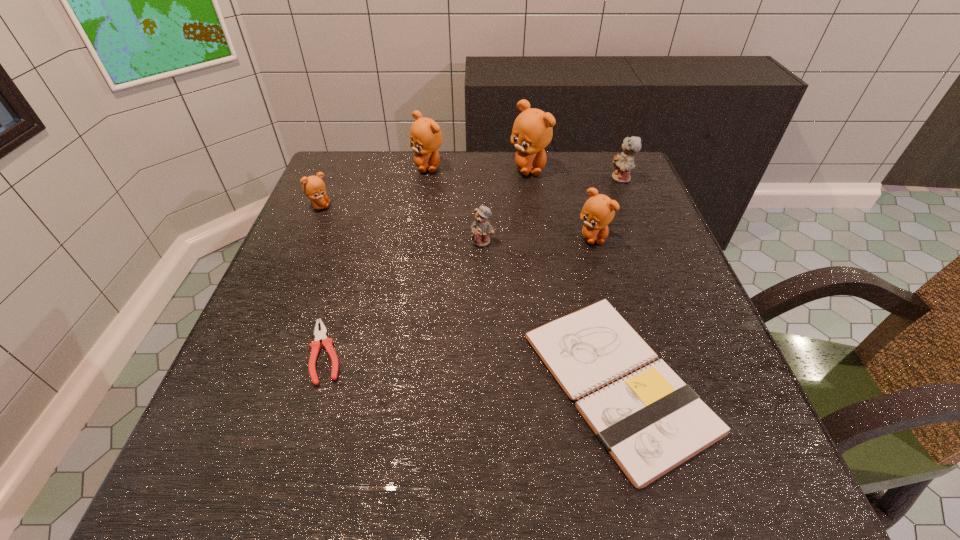
What are the coordinates of `the third closest teddy bear to the leftmost object` in the screenshot? It's located at (532, 131).

Where is `teddy bear identified as the fourth closest to the fourth object from left to right`? teddy bear identified as the fourth closest to the fourth object from left to right is located at coordinates (314, 188).

Identify which brown teddy bear is the third closest to the shortest object. Please provide its 2D coordinates. Your answer should be formatted as a tuple, i.e. [(x, y)], where the tuple contains the x and y coordinates of a point satisfying the conditions above.

[(425, 135)]

Locate which brown teddy bear ranks fourth in proximity to the smaller blue teddy bear. Please provide its 2D coordinates. Your answer should be formatted as a tuple, i.e. [(x, y)], where the tuple contains the x and y coordinates of a point satisfying the conditions above.

[(314, 188)]

The width and height of the screenshot is (960, 540). In order to click on free space in the image that satisfies the following two spatial constraints: 1. on the front-facing side of the right blue teddy bear; 2. on the face of the rightmost brown teddy bear in this screenshot , I will do `click(645, 237)`.

Identify the location of vacant area in the image that satisfies the following two spatial constraints: 1. on the face of the tallest teddy bear; 2. on the left side of the notepad. (560, 382).

You are a GUI agent. You are given a task and a screenshot of the screen. Output one action in this format:
    pyautogui.click(x=<x>, y=<y>)
    Task: Click on the blank area in the image that satisfies the following two spatial constraints: 1. on the face of the third brown teddy bear from left to right; 2. on the face of the fifth nearest object
    This screenshot has height=540, width=960.
    Given the screenshot: What is the action you would take?
    pyautogui.click(x=535, y=206)

You are a GUI agent. You are given a task and a screenshot of the screen. Output one action in this format:
    pyautogui.click(x=<x>, y=<y>)
    Task: Click on the vacant region that satisfies the following two spatial constraints: 1. on the face of the sixth object from right to left; 2. on the left side of the notepad
    This screenshot has width=960, height=540.
    Given the screenshot: What is the action you would take?
    pyautogui.click(x=395, y=382)

Identify the location of vacant area in the image that satisfies the following two spatial constraints: 1. on the front-facing side of the right blue teddy bear; 2. on the face of the rightmost brown teddy bear. (645, 237).